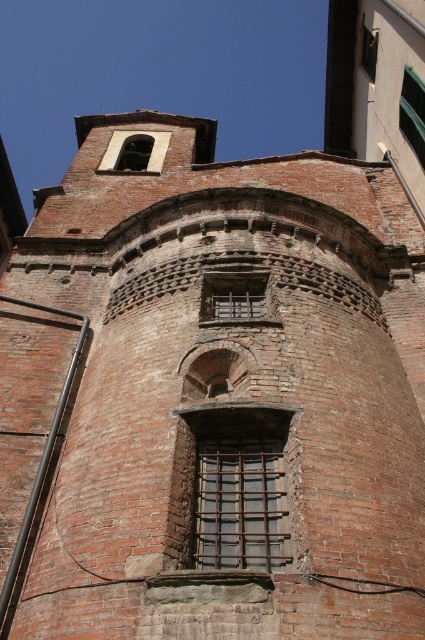
Question: Among these objects, which one is nearest to the camera?

Choices:
 (A) rusty metal bars at center
 (B) green glass window at upper right
 (C) matte brick bell tower at upper center
 (D) matte brick window at upper center

Answer: (A)

Question: Among these points, which one is nearest to the camera?

Choices:
 (A) (257, 298)
 (B) (371, 48)
 (C) (419, 131)

Answer: (A)

Question: Considering the relative positions of matte brick bell tower at upper center and matte brick window at upper center in the image provided, where is matte brick bell tower at upper center located with respect to matte brick window at upper center?

Choices:
 (A) below
 (B) above

Answer: (A)

Question: Can you confirm if rusty metal bars at center is smaller than matte brick bell tower at upper center?

Choices:
 (A) yes
 (B) no

Answer: (A)

Question: Which object is closer to the camera taking this photo?

Choices:
 (A) matte brick window at upper center
 (B) green glass window at upper right
 (C) matte brick bell tower at upper center
 (D) rusty metal bars at center

Answer: (D)

Question: Can you confirm if rusty metal bars at center is smaller than matte brick bell tower at upper center?

Choices:
 (A) no
 (B) yes

Answer: (B)